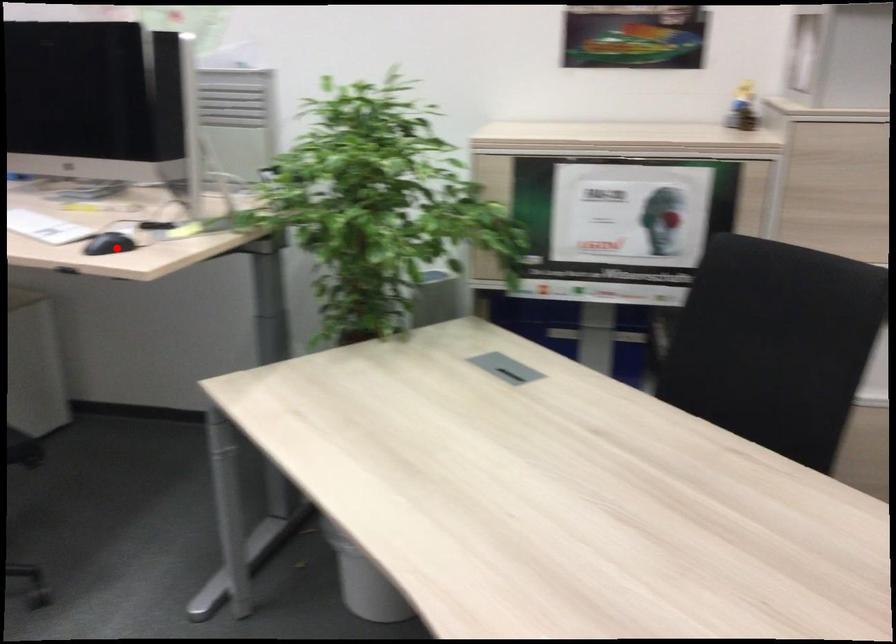
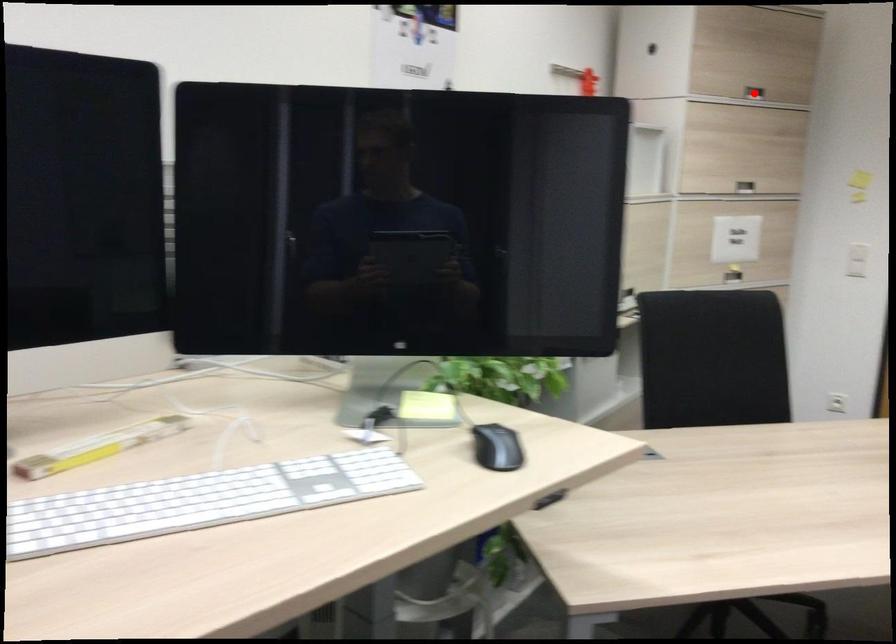
I am providing you with two images of the same scene from different viewpoints. A red point is marked on the first image and another point is marked on the second image. Are the points marked in image1 and image2 representing the same 3D position?

No